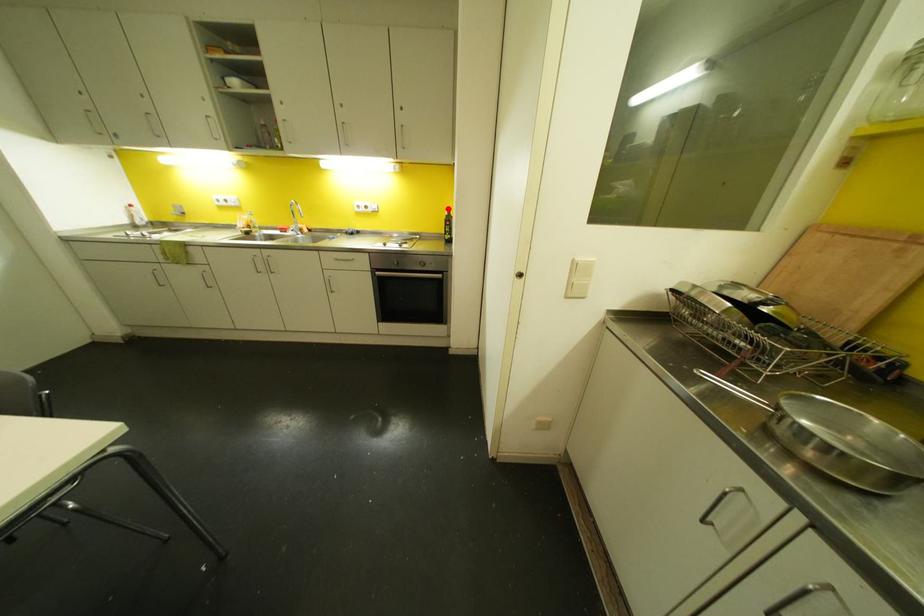
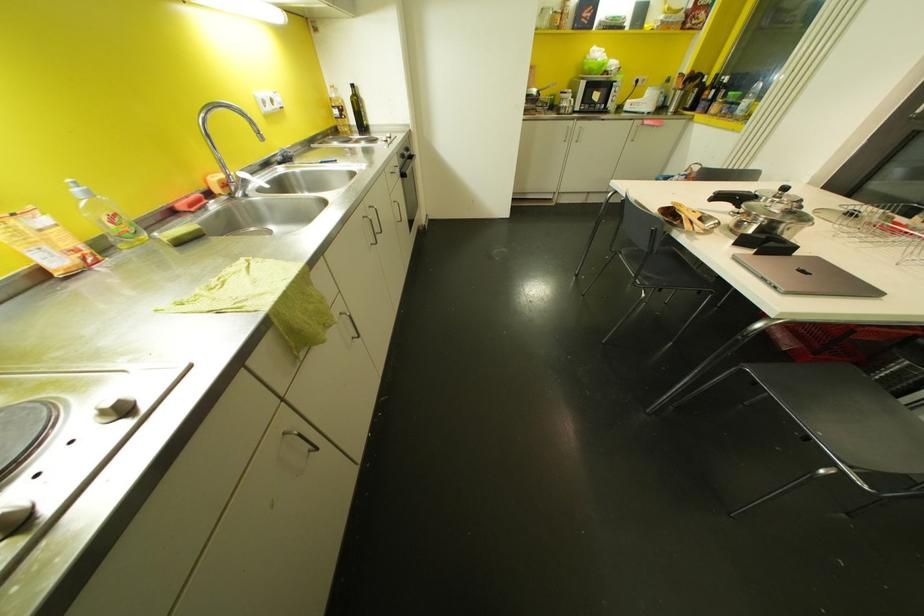
Where in the second image is the point corresponding to the highlighted location from the first image?

(353, 84)